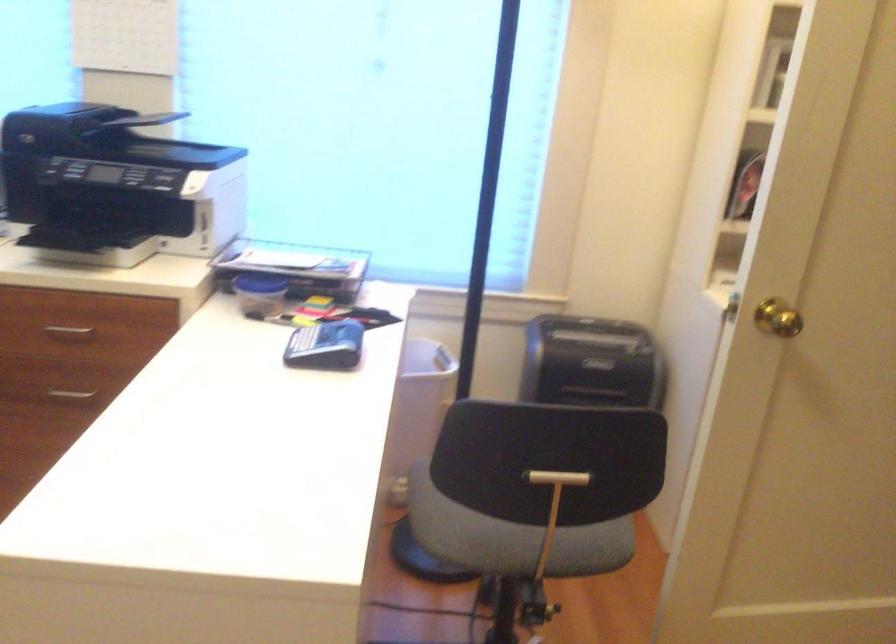
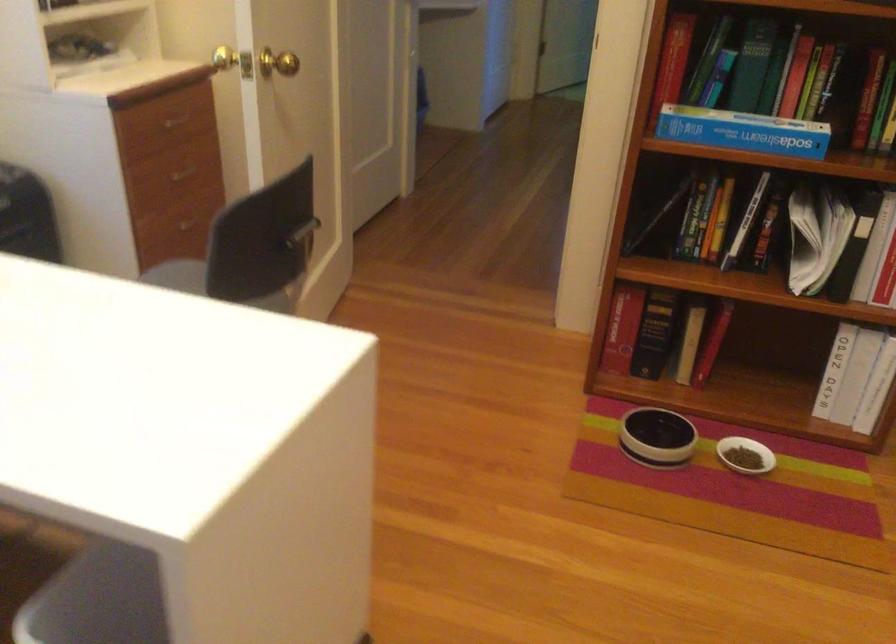
Based on the continuous images, in which direction is the camera rotating?

The camera rotated toward right-down.